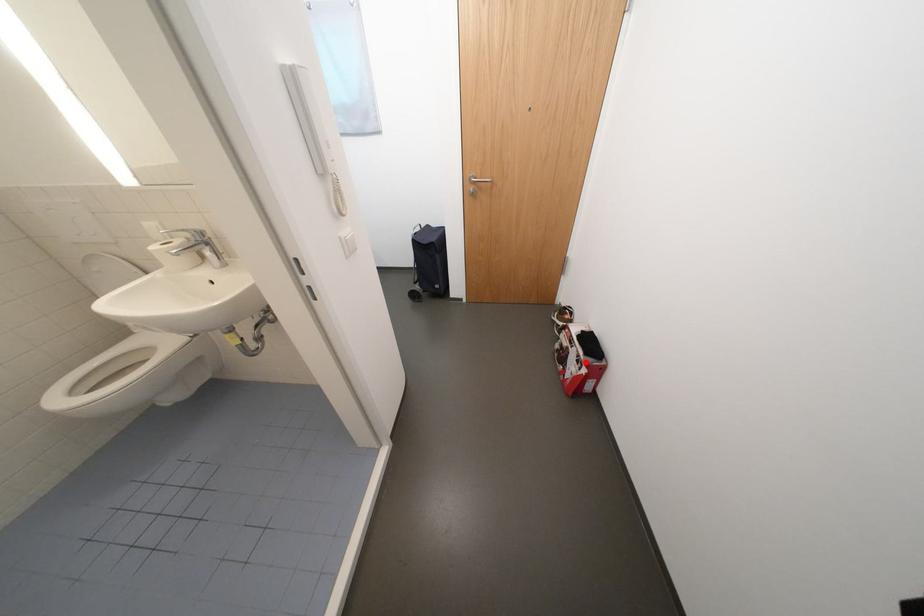
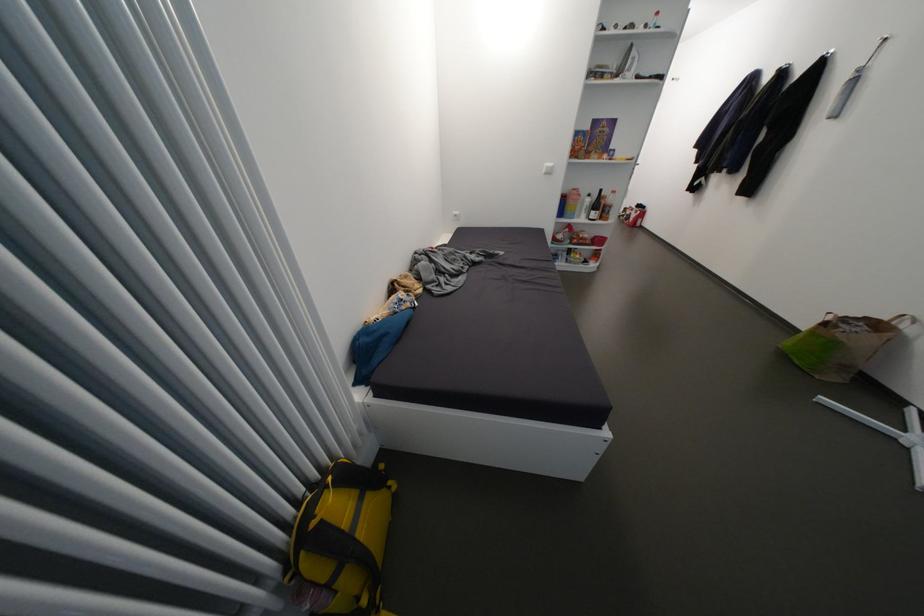
Where in the second image is the point corresponding to the highlighted location from the first image?

(642, 214)